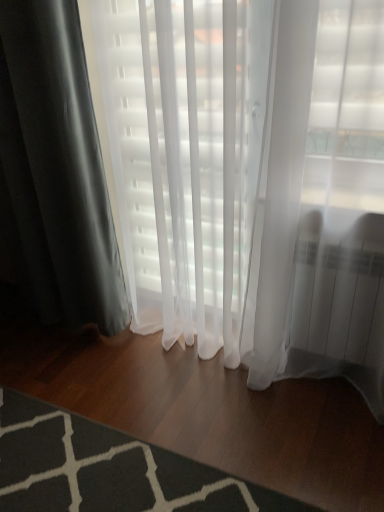
Where is `free spot in front of matte black curtain at left`? The image size is (384, 512). free spot in front of matte black curtain at left is located at coordinates (58, 373).